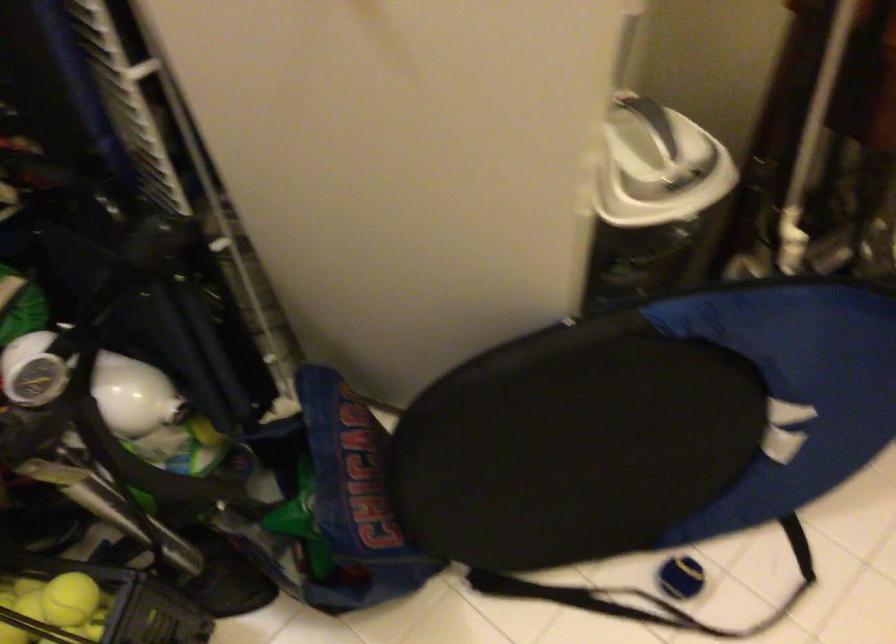
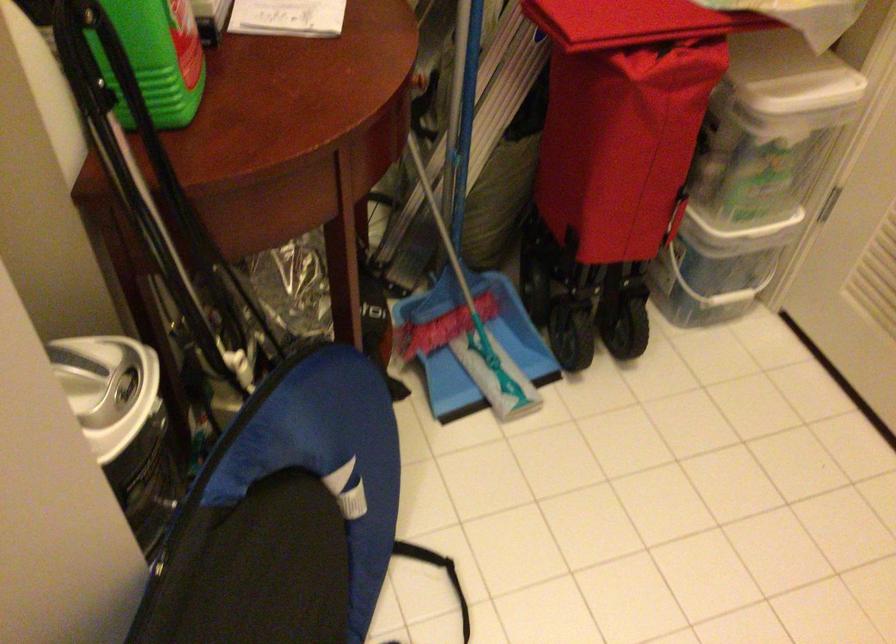
In the second image, find the point that corresponds to the point at 648,207 in the first image.

(123, 424)